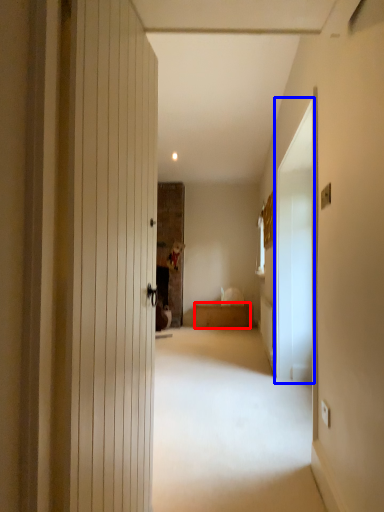
Question: Which object is closer to the camera taking this photo, furniture (highlighted by a red box) or screen door (highlighted by a blue box)?

Choices:
 (A) furniture
 (B) screen door

Answer: (B)